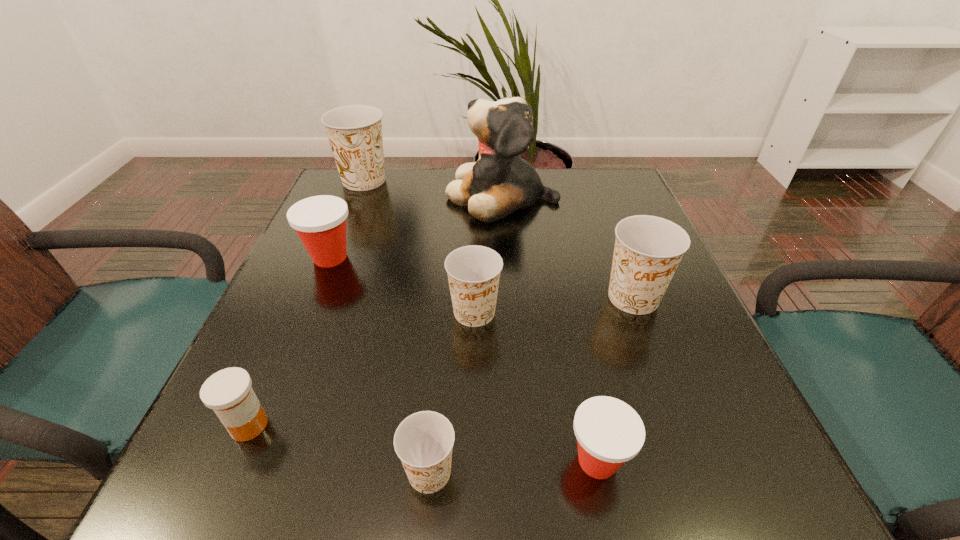
I want to click on empty space between the puppy and the biggest orange Dixie cup, so [433, 188].

Locate an element on the screen. This screenshot has width=960, height=540. free spot between the smaller red-orange Dixie cup and the third biggest orange Dixie cup is located at coordinates (536, 387).

Find the location of a particular element. Image resolution: width=960 pixels, height=540 pixels. object that is the sixth closest to the farthest orange Dixie cup is located at coordinates (423, 441).

Where is `object that is the sixth closest one to the nearer red-orange Dixie cup`? object that is the sixth closest one to the nearer red-orange Dixie cup is located at coordinates [500, 182].

You are a GUI agent. You are given a task and a screenshot of the screen. Output one action in this format:
    pyautogui.click(x=<x>, y=<y>)
    Task: Click on the Dixie cup object that ranks as the third closest to the rightmost object
    The width and height of the screenshot is (960, 540).
    Given the screenshot: What is the action you would take?
    pyautogui.click(x=423, y=441)

Select which Dixie cup appears as the closest to the rightmost orange Dixie cup. Please provide its 2D coordinates. Your answer should be formatted as a tuple, i.e. [(x, y)], where the tuple contains the x and y coordinates of a point satisfying the conditions above.

[(473, 271)]

The height and width of the screenshot is (540, 960). I want to click on orange Dixie cup that is the closest to the farthest Dixie cup, so click(473, 271).

Locate which orange Dixie cup is the third closest to the third biggest orange Dixie cup. Please provide its 2D coordinates. Your answer should be formatted as a tuple, i.e. [(x, y)], where the tuple contains the x and y coordinates of a point satisfying the conditions above.

[(354, 132)]

At what (x,y) coordinates should I click in order to perform the action: click on free space that satisfies the following two spatial constraints: 1. at the face of the tallest object; 2. on the back side of the fifth Dixie cup from left to right. Please return your answer as a coordinate pair (x, y). This screenshot has width=960, height=540. Looking at the image, I should click on (521, 461).

Identify the location of free point that satisfies the following two spatial constraints: 1. on the front side of the fifth Dixie cup from left to right; 2. on the left side of the third biggest orange Dixie cup. The height and width of the screenshot is (540, 960). coord(472,461).